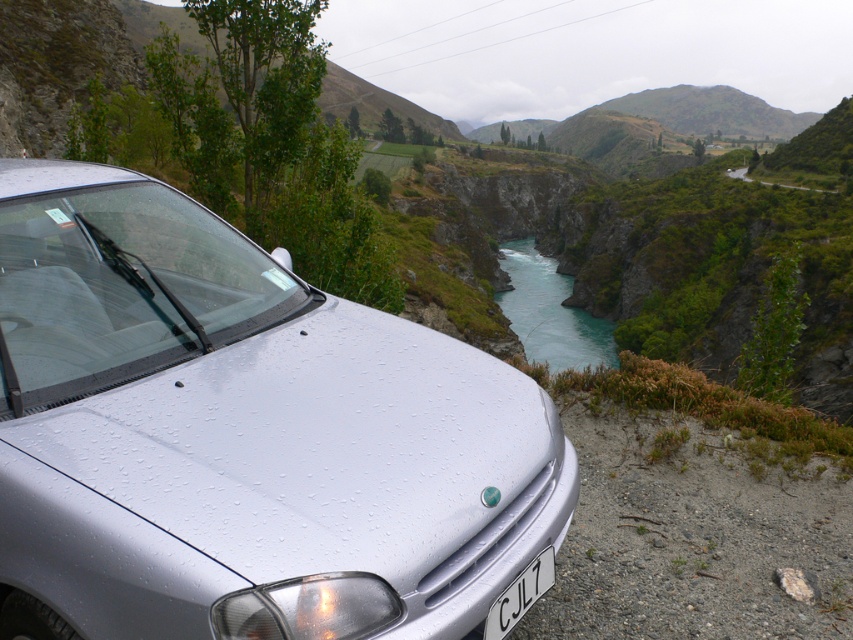
You are a photographer wanting to capture the black plastic license plate at bottom center clearly in your photo. However, the satin silver car at center is blocking your view. Can you move the car to the side so that the license plate becomes visible?

The satin silver car at center is positioned over black plastic license plate at bottom center, so moving the car to the side would allow the license plate to become visible.

From the picture: You are a hiker who wants to cross the turquoise smooth water at center using the satin silver car at center. Is the car positioned in a suitable location to drive into the water?

The satin silver car at center is positioned on the left side of the turquoise smooth water at center, so the car is already placed in a suitable location to drive into the water.

You are a photographer standing at the camera position. You want to take a photo of the silver car parked on the gravelly roadside. There are two points marked in the image. The first point is at coordinates point (x=4, y=602) and the second point is at point (x=572, y=307). Which of these points is closer to you when you are taking the photo?

Point (x=4, y=602) is closer to the camera than point (x=572, y=307).